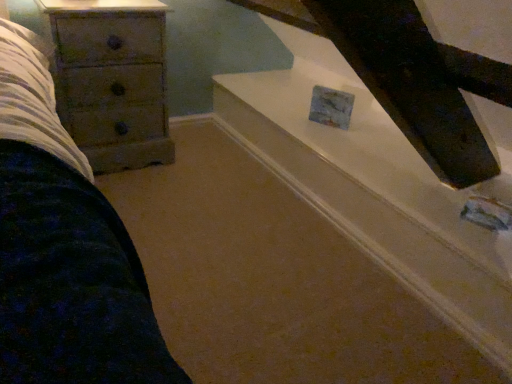
Identify the location of white glossy stairwell at upper center. The width and height of the screenshot is (512, 384). (377, 197).

Describe the element at coordinates (377, 197) in the screenshot. I see `white glossy stairwell at upper center` at that location.

Find the location of `wooden chest of drawers at left`. wooden chest of drawers at left is located at coordinates (112, 82).

What do you see at coordinates (112, 82) in the screenshot? I see `wooden chest of drawers at left` at bounding box center [112, 82].

Where is `white glossy stairwell at upper center`? Image resolution: width=512 pixels, height=384 pixels. white glossy stairwell at upper center is located at coordinates (377, 197).

Which is more to the left, wooden chest of drawers at left or white glossy stairwell at upper center?

Positioned to the left is wooden chest of drawers at left.

Considering the positions of objects wooden chest of drawers at left and white glossy stairwell at upper center in the image provided, who is in front, wooden chest of drawers at left or white glossy stairwell at upper center?

Positioned in front is white glossy stairwell at upper center.

Is point (86, 139) closer or farther from the camera than point (421, 178)?

Clearly, point (86, 139) is more distant from the camera than point (421, 178).

From the image's perspective, which is above, wooden chest of drawers at left or white glossy stairwell at upper center?

wooden chest of drawers at left.

From a real-world perspective, which is physically below, wooden chest of drawers at left or white glossy stairwell at upper center?

Result: white glossy stairwell at upper center, from a real-world perspective.

Between wooden chest of drawers at left and white glossy stairwell at upper center, which one has smaller width?

wooden chest of drawers at left.

Considering the sizes of wooden chest of drawers at left and white glossy stairwell at upper center in the image, is wooden chest of drawers at left taller or shorter than white glossy stairwell at upper center?

Clearly, wooden chest of drawers at left is taller compared to white glossy stairwell at upper center.

Considering the sizes of objects wooden chest of drawers at left and white glossy stairwell at upper center in the image provided, who is smaller, wooden chest of drawers at left or white glossy stairwell at upper center?

With smaller size is wooden chest of drawers at left.

Is wooden chest of drawers at left positioned beyond the bounds of white glossy stairwell at upper center?

Yes, wooden chest of drawers at left is outside of white glossy stairwell at upper center.

Looking at this image, are wooden chest of drawers at left and white glossy stairwell at upper center located far from each other?

No, wooden chest of drawers at left is not far from white glossy stairwell at upper center.

Is wooden chest of drawers at left positioned with its back to white glossy stairwell at upper center?

wooden chest of drawers at left is not turned away from white glossy stairwell at upper center.

How many degrees apart are the facing directions of wooden chest of drawers at left and white glossy stairwell at upper center?

They differ by 88.9 degrees in their facing directions.

I want to click on chest of drawers above the white glossy stairwell at upper center (from a real-world perspective), so click(112, 82).

Considering the relative positions of white glossy stairwell at upper center and wooden chest of drawers at left in the image provided, is white glossy stairwell at upper center to the right of wooden chest of drawers at left from the viewer's perspective?

Yes, white glossy stairwell at upper center is to the right of wooden chest of drawers at left.

Which object is closer to the camera taking this photo, white glossy stairwell at upper center or wooden chest of drawers at left?

white glossy stairwell at upper center.

Is point (510, 154) less distant than point (101, 155)?

Yes, it is.

From the image's perspective, is white glossy stairwell at upper center beneath wooden chest of drawers at left?

Yes, from the image's perspective, white glossy stairwell at upper center is beneath wooden chest of drawers at left.

From a real-world perspective, is white glossy stairwell at upper center positioned over wooden chest of drawers at left based on gravity?

No, from a real-world perspective, white glossy stairwell at upper center is not over wooden chest of drawers at left

Is white glossy stairwell at upper center thinner than wooden chest of drawers at left?

No.

Consider the image. Can you confirm if white glossy stairwell at upper center is taller than wooden chest of drawers at left?

No.

Who is bigger, white glossy stairwell at upper center or wooden chest of drawers at left?

white glossy stairwell at upper center is bigger.

Would you say white glossy stairwell at upper center is outside wooden chest of drawers at left?

That's correct, white glossy stairwell at upper center is outside of wooden chest of drawers at left.

Are white glossy stairwell at upper center and wooden chest of drawers at left far apart?

They are positioned close to each other.

Is white glossy stairwell at upper center facing away from wooden chest of drawers at left?

No, wooden chest of drawers at left is not at the back of white glossy stairwell at upper center.

Can you tell me how much white glossy stairwell at upper center and wooden chest of drawers at left differ in facing direction?

They differ by 88.9 degrees in their facing directions.

Locate an element on the screen. chest of drawers above the white glossy stairwell at upper center (from the image's perspective) is located at coordinates (112, 82).

I want to click on stairwell in front of the wooden chest of drawers at left, so click(x=377, y=197).

Identify the location of the chest of drawers above the white glossy stairwell at upper center (from a real-world perspective). (112, 82).